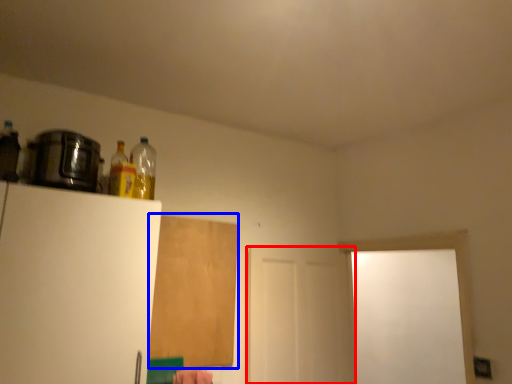
Question: Which of the following is the closest to the observer, screen door (highlighted by a red box) or plywood (highlighted by a blue box)?

Choices:
 (A) screen door
 (B) plywood

Answer: (B)